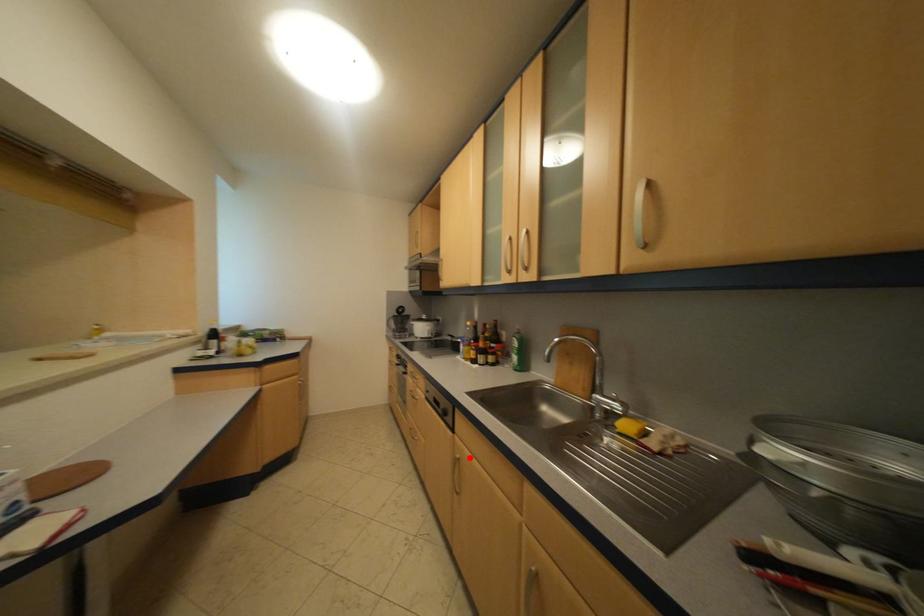
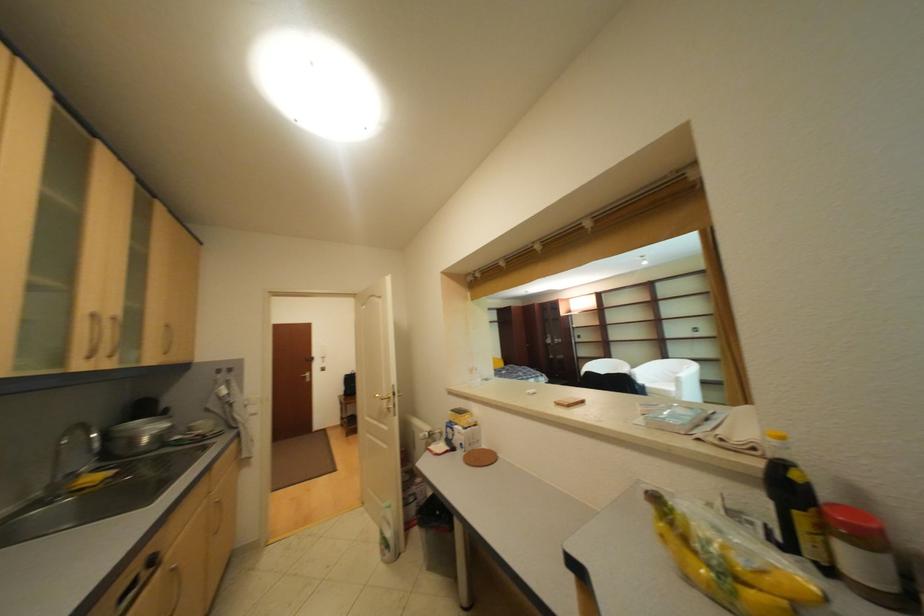
Where in the second image is the point corresponding to the highlighted location from the first image?

(186, 567)